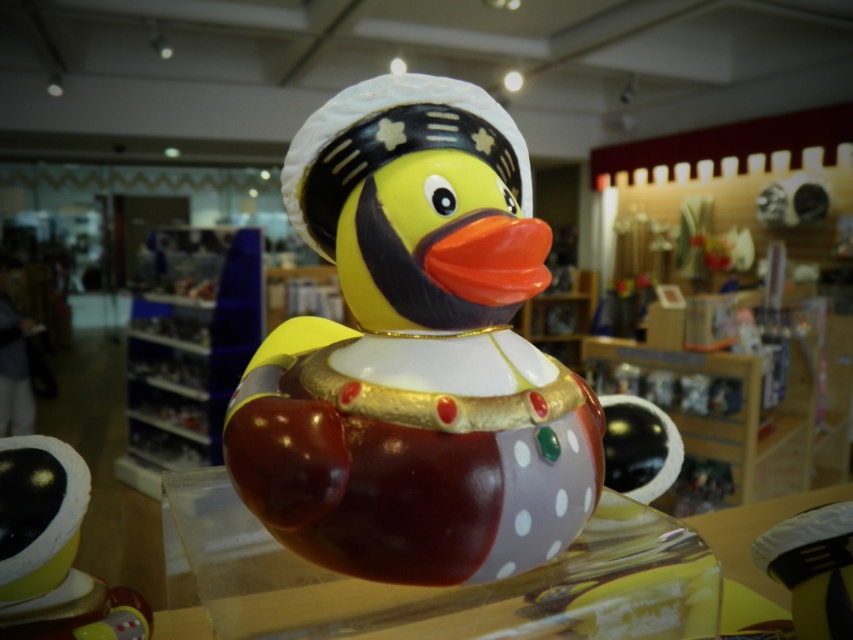
Question: Which point is closer to the camera?

Choices:
 (A) (19, 579)
 (B) (352, 259)

Answer: (B)

Question: Is polished ceramic duck at center smaller than shiny gold duck at center?

Choices:
 (A) yes
 (B) no

Answer: (B)

Question: Which point appears closest to the camera in this image?

Choices:
 (A) (45, 573)
 (B) (492, 435)

Answer: (B)

Question: Is polished ceramic duck at center below shiny gold duck at center?

Choices:
 (A) yes
 (B) no

Answer: (B)

Question: Does polished ceramic duck at center have a smaller size compared to shiny gold duck at center?

Choices:
 (A) yes
 (B) no

Answer: (B)